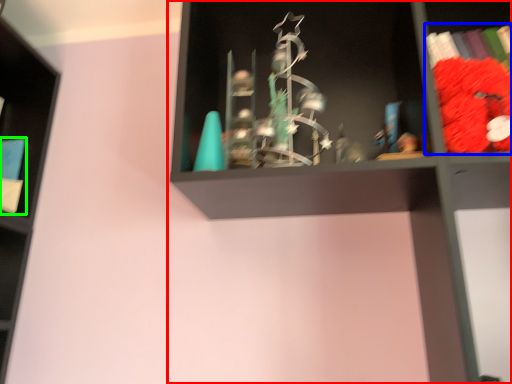
Question: Which is nearer to the shelf (highlighted by a red box)? book (highlighted by a blue box) or book (highlighted by a green box).

Choices:
 (A) book
 (B) book

Answer: (A)